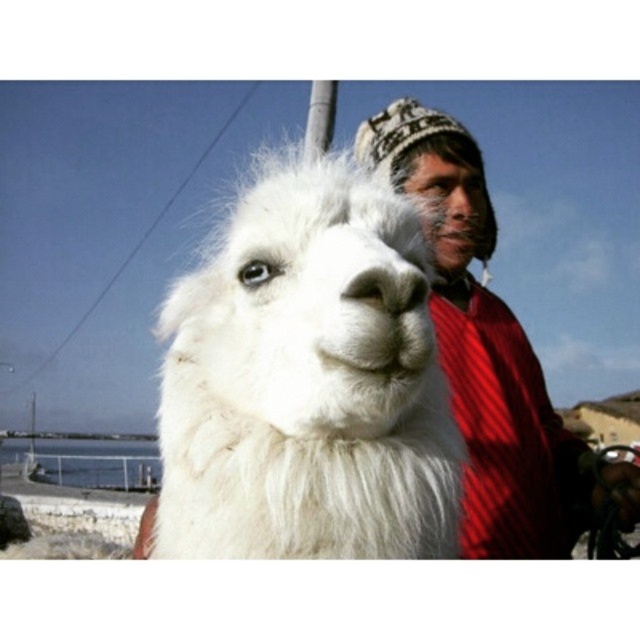
You are a photographer trying to capture both the white fluffy alpaca at center and the knitted woolen hat at upper right in the same frame. Based on their sizes, which object would you need to adjust your camera angle to include more of?

The knitted woolen hat at upper right is wider than the white fluffy alpaca at center, so you would need to adjust your camera angle to include more of the knitted woolen hat at upper right.